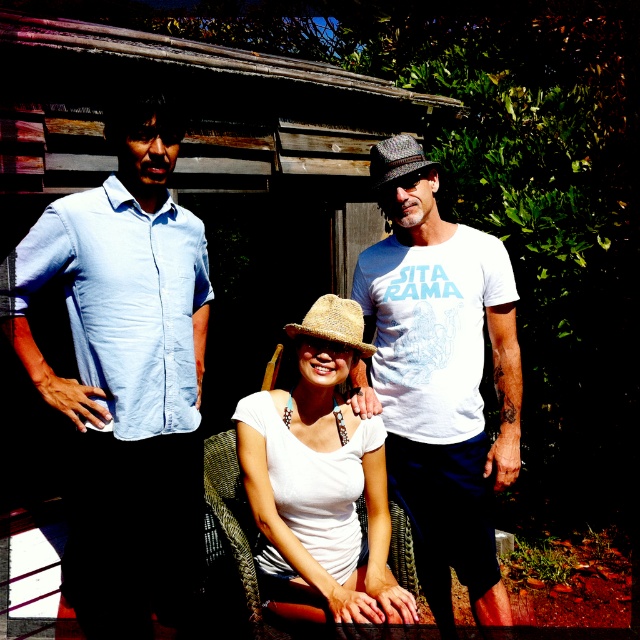
Is strawmaterial/texturecowboy hat at center below shiny metallic cowboy hat at center?

Yes.

Identify the location of strawmaterial/texturecowboy hat at center. pyautogui.click(x=333, y=323).

The height and width of the screenshot is (640, 640). Find the location of `light blue cotton shirt at left`. light blue cotton shirt at left is located at coordinates (125, 372).

Is light blue cotton shirt at left to the right of shiny metallic cowboy hat at center from the viewer's perspective?

In fact, light blue cotton shirt at left is to the left of shiny metallic cowboy hat at center.

Is point (68, 204) closer to viewer compared to point (420, 164)?

That is True.

What are the coordinates of `light blue cotton shirt at left` in the screenshot? It's located at (125, 372).

Identify the location of white woven hat at center. This screenshot has width=640, height=640. (321, 481).

The width and height of the screenshot is (640, 640). What do you see at coordinates (321, 481) in the screenshot?
I see `white woven hat at center` at bounding box center [321, 481].

Identify the location of white woven hat at center. click(x=321, y=481).